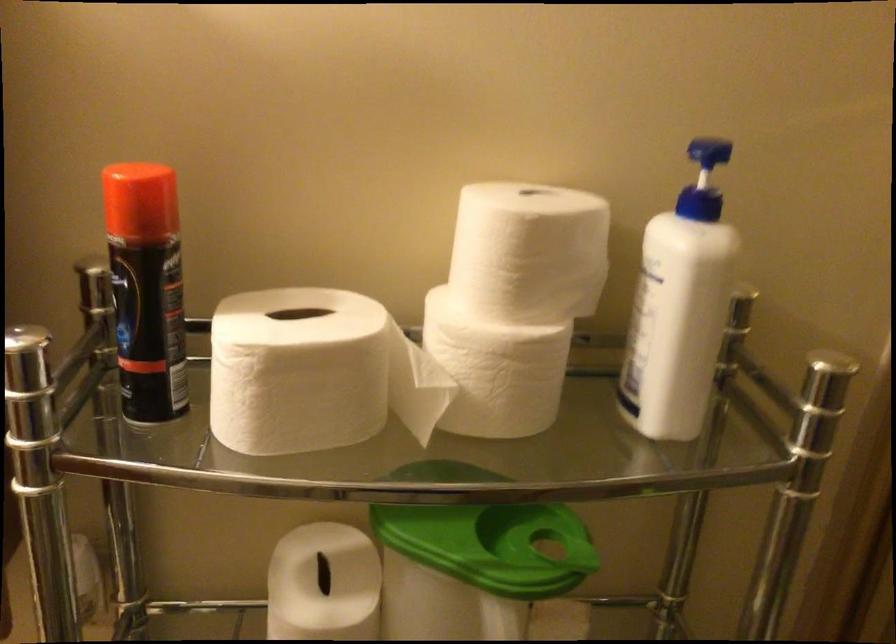
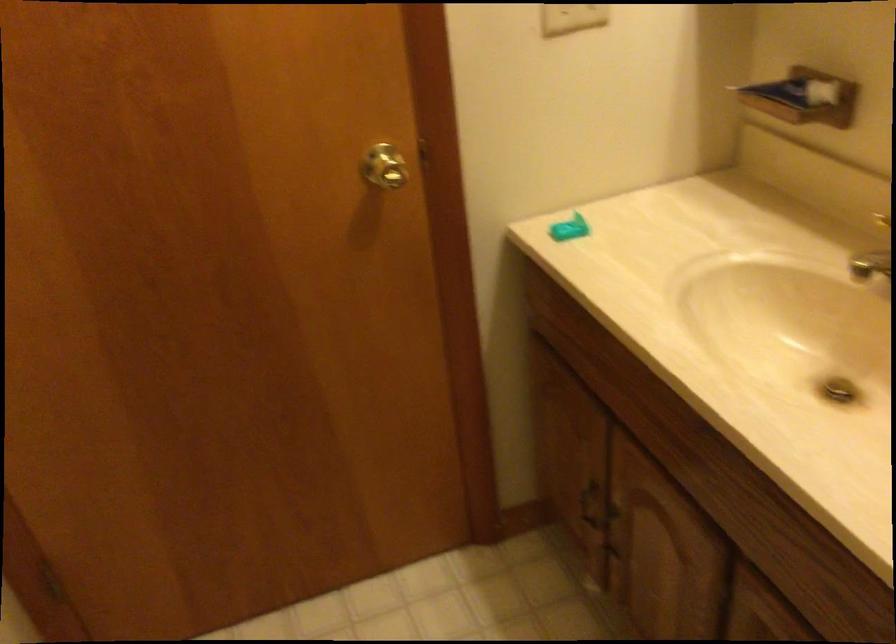
How did the camera likely rotate?

The camera's rotation is toward left-down.